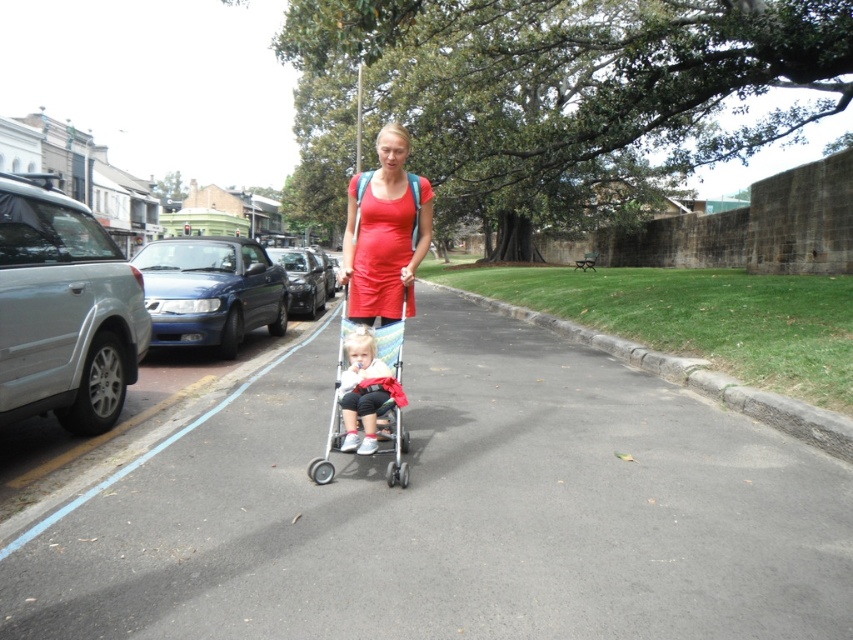
You are a delivery person trying to navigate through the street while avoiding obstacles. There is a plastic baby carriage at center represented by point (334, 410). Where should you steer your delivery cart to go around it?

The plastic baby carriage at center is located at point (334, 410). To navigate around it, steer your delivery cart either to the left or right side of the point to avoid collision.

You are a pedestrian walking along the road in the image. You see two points marked on the pavement. The first point is at coordinates point (360, 394) and the second point is at point (287, 276). Which point is closer to your current position if you are facing the direction the woman in the red dress is walking?

Point (360, 394) is in front of point (287, 276), so if you are facing the direction the woman in the red dress is walking, the point (360, 394) would be closer to your current position since it is ahead of the other point.